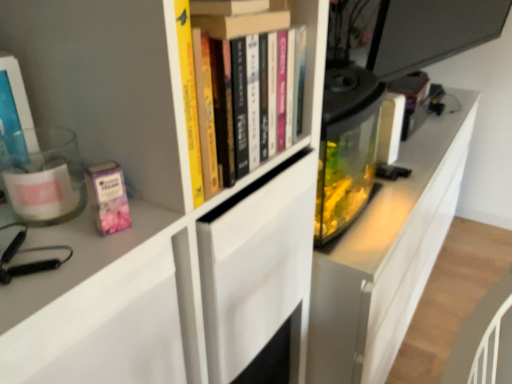
Question: Is hardcover books at upper center, positioned as the 1th book in right-to-left order, closer to the viewer compared to translucent plastic container at left, which is the second book from right to left?

Choices:
 (A) yes
 (B) no

Answer: (B)

Question: Would you say hardcover books at upper center, positioned as the 1th book in right-to-left order, is a long distance from translucent plastic container at left, acting as the 1th book starting from the left?

Choices:
 (A) no
 (B) yes

Answer: (A)

Question: Is hardcover books at upper center, positioned as the 1th book in right-to-left order, not inside translucent plastic container at left, which is the second book from right to left?

Choices:
 (A) no
 (B) yes

Answer: (B)

Question: Does hardcover books at upper center, positioned as the 1th book in right-to-left order, have a lesser width compared to translucent plastic container at left, acting as the 1th book starting from the left?

Choices:
 (A) no
 (B) yes

Answer: (A)

Question: Does hardcover books at upper center, the second book viewed from the left, have a larger size compared to translucent plastic container at left, acting as the 1th book starting from the left?

Choices:
 (A) yes
 (B) no

Answer: (A)

Question: Is hardcover books at upper center, the second book viewed from the left, taller than translucent plastic container at left, which is the second book from right to left?

Choices:
 (A) yes
 (B) no

Answer: (A)

Question: Does translucent plastic container at left, acting as the 1th book starting from the left, have a greater height compared to hardcover books at upper center, positioned as the 1th book in right-to-left order?

Choices:
 (A) yes
 (B) no

Answer: (B)

Question: Is translucent plastic container at left, which is the second book from right to left, positioned behind hardcover books at upper center, the second book viewed from the left?

Choices:
 (A) no
 (B) yes

Answer: (A)

Question: Is translucent plastic container at left, which is the second book from right to left, shorter than hardcover books at upper center, the second book viewed from the left?

Choices:
 (A) no
 (B) yes

Answer: (B)

Question: From the image's perspective, is translucent plastic container at left, which is the second book from right to left, on hardcover books at upper center, positioned as the 1th book in right-to-left order?

Choices:
 (A) no
 (B) yes

Answer: (A)

Question: Is translucent plastic container at left, which is the second book from right to left, turned away from hardcover books at upper center, positioned as the 1th book in right-to-left order?

Choices:
 (A) no
 (B) yes

Answer: (A)

Question: Considering the relative sizes of translucent plastic container at left, acting as the 1th book starting from the left, and hardcover books at upper center, positioned as the 1th book in right-to-left order, in the image provided, is translucent plastic container at left, acting as the 1th book starting from the left, smaller than hardcover books at upper center, positioned as the 1th book in right-to-left order,?

Choices:
 (A) no
 (B) yes

Answer: (B)

Question: From a real-world perspective, is pink matte paperback book at left under hardcover books at upper center, the second book viewed from the left?

Choices:
 (A) no
 (B) yes

Answer: (B)